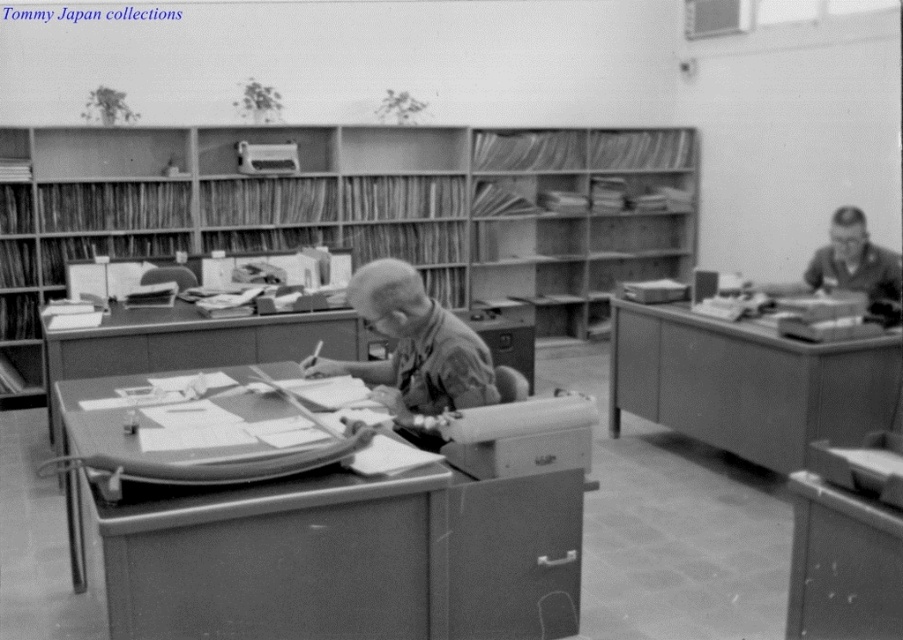
Between point (675, 378) and point (896, 323), which one is positioned in front?

Point (896, 323) is in front.

Does smooth wood table at right have a lesser width compared to matte gray uniform at right?

In fact, smooth wood table at right might be wider than matte gray uniform at right.

Which is behind, point (771, 374) or point (860, 278)?

The point (860, 278) is more distant.

Locate an element on the screen. The height and width of the screenshot is (640, 903). smooth wood table at right is located at coordinates coord(748,381).

Who is taller, wooden shelves at center or matte gray uniform at right?

wooden shelves at center is taller.

Does wooden shelves at center appear on the right side of matte gray uniform at right?

In fact, wooden shelves at center is to the left of matte gray uniform at right.

Is point (219, 150) more distant than point (868, 310)?

Yes, point (219, 150) is farther from viewer.

Find the location of a particular element. Image resolution: width=903 pixels, height=640 pixels. wooden shelves at center is located at coordinates (361, 216).

Does smooth wood table at right have a greater width compared to smooth brown shirt at center?

Yes, smooth wood table at right is wider than smooth brown shirt at center.

Measure the distance from smooth wood table at right to smooth brown shirt at center.

They are 6.13 feet apart.

Who is more distant from viewer, (664, 305) or (407, 378)?

Positioned behind is point (664, 305).

Locate an element on the screen. The image size is (903, 640). smooth wood table at right is located at coordinates coord(748,381).